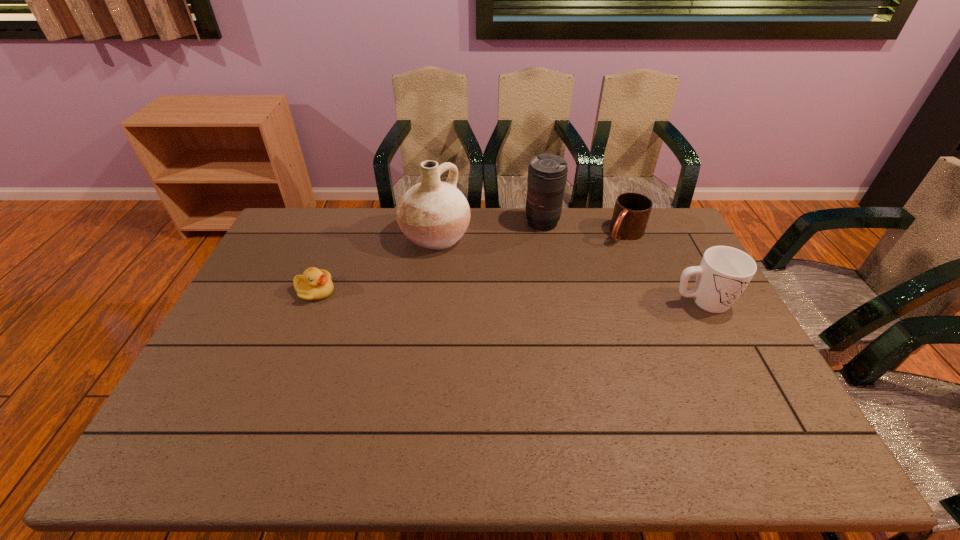
Locate an element on the screen. The image size is (960, 540). free space between the fourth shortest object and the taller mug is located at coordinates (622, 262).

What are the coordinates of `unoccupied area between the third shortest object and the farther mug` in the screenshot? It's located at 663,268.

The image size is (960, 540). I want to click on free space between the pottery and the third tallest object, so (569, 269).

Find the location of a particular element. The image size is (960, 540). free point between the third shortest object and the shorter mug is located at coordinates tap(663, 268).

Find the location of a particular element. vacant region between the fourth object from right to left and the nearer mug is located at coordinates (569, 269).

Locate an element on the screen. free spot between the taller mug and the fourth shortest object is located at coordinates (622, 262).

Identify the location of vacant space that's between the shortest object and the pottery. This screenshot has height=540, width=960. (375, 264).

Locate an element on the screen. free space between the second object from left to right and the third object from right to left is located at coordinates (489, 230).

The image size is (960, 540). Find the location of `vacant region between the pottery and the duckling`. vacant region between the pottery and the duckling is located at coordinates (375, 264).

Where is `free space between the farther mug and the leftmost object`? This screenshot has height=540, width=960. free space between the farther mug and the leftmost object is located at coordinates (470, 262).